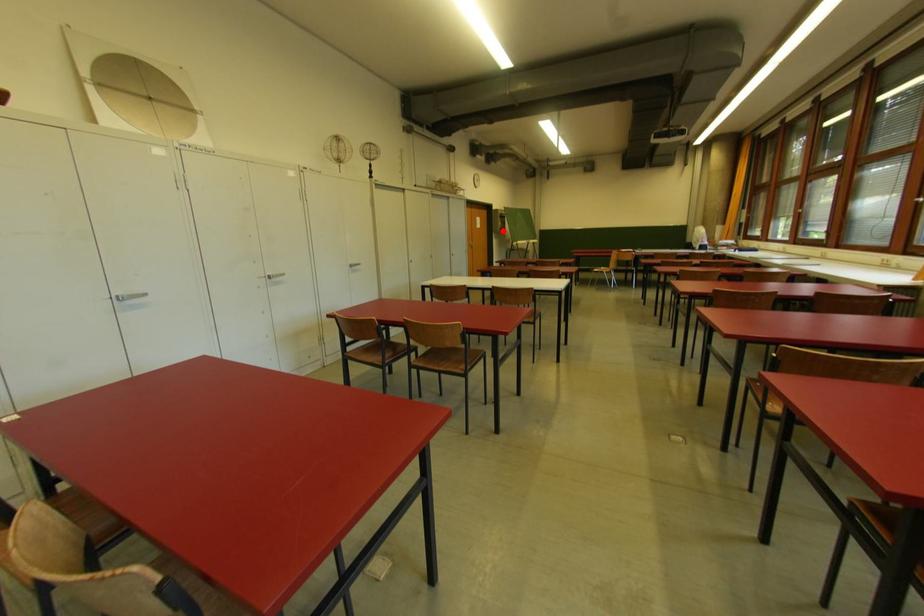
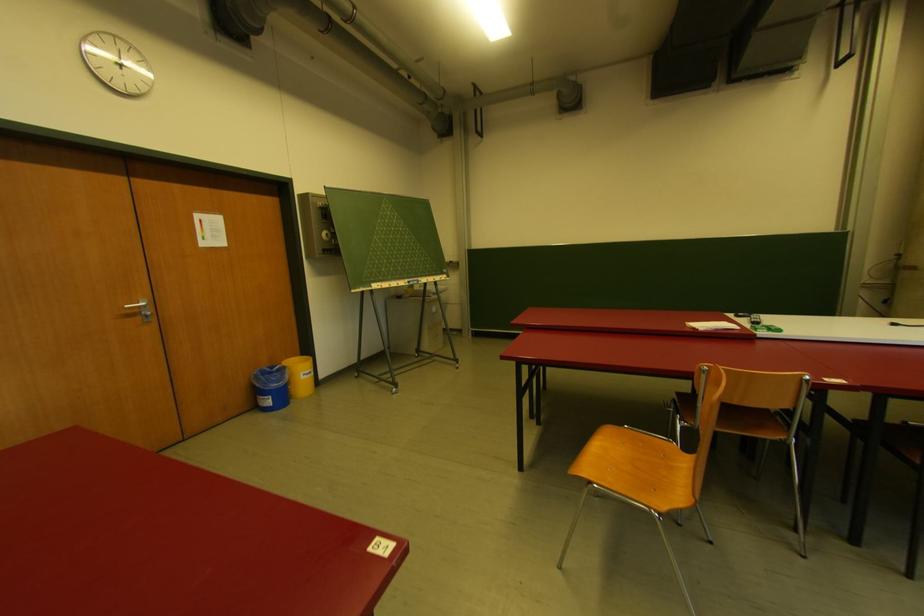
Question: I am providing you with two images of the same scene from different viewpoints. Image1 has a red point marked. In image2, the corresponding 3D location appears at what relative position? Reply with the corresponding letter.

Choices:
 (A) Closer
 (B) Farther

Answer: (B)